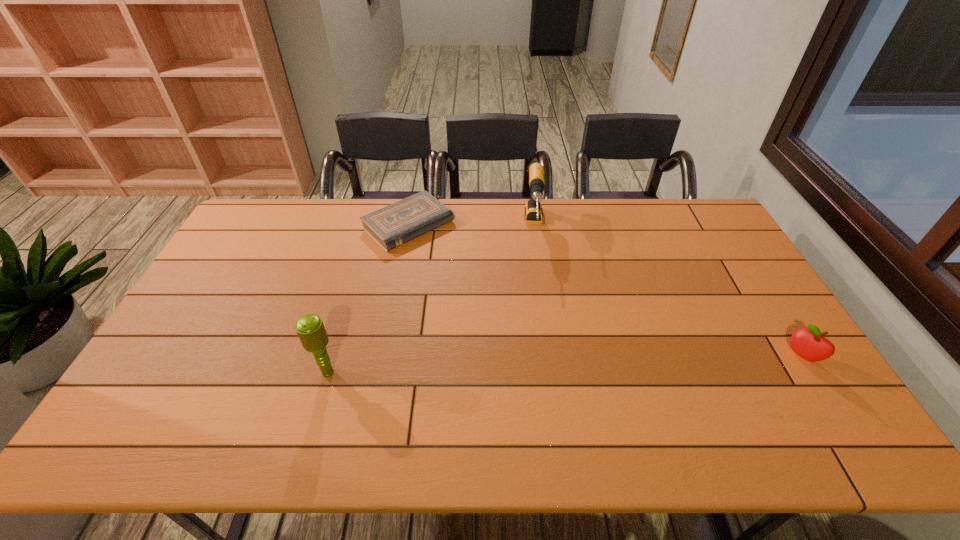
At what (x,y) coordinates should I click in order to perform the action: click on vacant spot on the desktop that is between the microphone and the rightmost object and is positioned on the handle side of the drill. Please return your answer as a coordinate pair (x, y). Looking at the image, I should click on (537, 366).

Locate an element on the screen. The height and width of the screenshot is (540, 960). vacant space on the desktop that is between the microphone and the rightmost object and is positioned on the spine side of the shortest object is located at coordinates (568, 364).